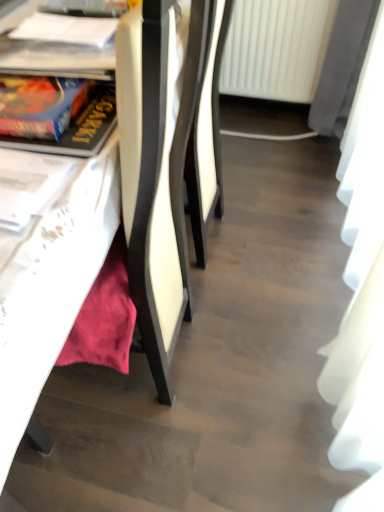
Question: Is white paper at upper left, the first book from the back, positioned beyond the bounds of white fabric curtain at right?

Choices:
 (A) yes
 (B) no

Answer: (A)

Question: From the image's perspective, would you say white paper at upper left, placed as the 2th book when sorted from bottom to top, is shown under white fabric curtain at right?

Choices:
 (A) no
 (B) yes

Answer: (A)

Question: Is white paper at upper left, which is the 2th book from front to back, positioned in front of white fabric curtain at right?

Choices:
 (A) no
 (B) yes

Answer: (A)

Question: Can you confirm if white paper at upper left, which ranks as the 1th book in top-to-bottom order, is taller than white fabric curtain at right?

Choices:
 (A) no
 (B) yes

Answer: (A)

Question: Considering the relative positions of white paper at upper left, placed as the 2th book when sorted from bottom to top, and white fabric curtain at right in the image provided, is white paper at upper left, placed as the 2th book when sorted from bottom to top, to the left of white fabric curtain at right from the viewer's perspective?

Choices:
 (A) no
 (B) yes

Answer: (B)

Question: From a real-world perspective, is white paper at upper left, which ranks as the 1th book in top-to-bottom order, under white fabric curtain at right?

Choices:
 (A) no
 (B) yes

Answer: (A)

Question: From a real-world perspective, is white plastic radiator at upper center physically below white paper at upper left, the first book from the back?

Choices:
 (A) yes
 (B) no

Answer: (A)

Question: Is the depth of white plastic radiator at upper center greater than that of white paper at upper left, which is the 2th book from front to back?

Choices:
 (A) yes
 (B) no

Answer: (A)

Question: Considering the relative positions of white plastic radiator at upper center and white paper at upper left, the first book from the back, in the image provided, is white plastic radiator at upper center to the left of white paper at upper left, the first book from the back, from the viewer's perspective?

Choices:
 (A) no
 (B) yes

Answer: (A)

Question: Does white plastic radiator at upper center have a lesser height compared to white paper at upper left, placed as the 2th book when sorted from bottom to top?

Choices:
 (A) yes
 (B) no

Answer: (B)

Question: Does white plastic radiator at upper center have a larger size compared to white paper at upper left, placed as the 2th book when sorted from bottom to top?

Choices:
 (A) yes
 (B) no

Answer: (A)

Question: From the image's perspective, does white plastic radiator at upper center appear higher than white paper at upper left, the first book from the back?

Choices:
 (A) no
 (B) yes

Answer: (B)

Question: Are white fabric curtain at right and blue cardboard book at left, the second book positioned from the back, beside each other?

Choices:
 (A) yes
 (B) no

Answer: (B)